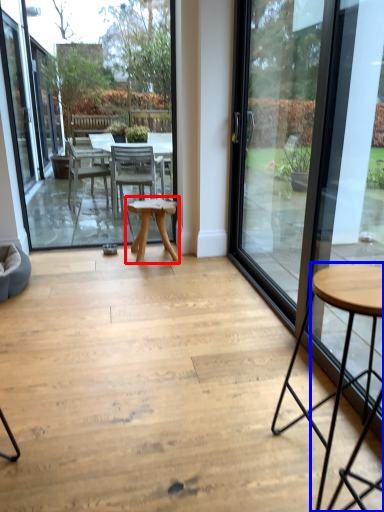
Question: Which object is closer to the camera taking this photo, table (highlighted by a red box) or coffee table (highlighted by a blue box)?

Choices:
 (A) table
 (B) coffee table

Answer: (B)